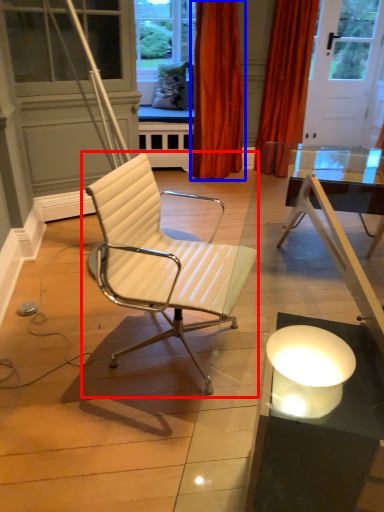
Question: Which object is closer to the camera taking this photo, chair (highlighted by a red box) or curtain (highlighted by a blue box)?

Choices:
 (A) chair
 (B) curtain

Answer: (A)